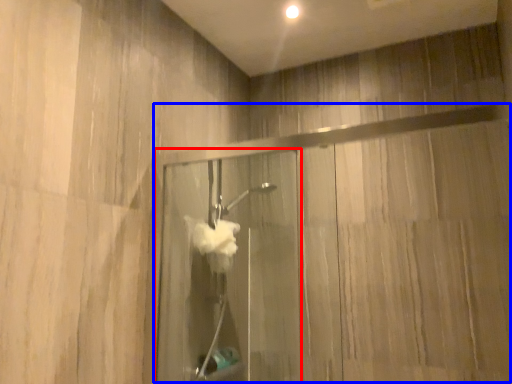
Question: Which point is further to the camera, screen door (highlighted by a red box) or glass door (highlighted by a blue box)?

Choices:
 (A) screen door
 (B) glass door

Answer: (A)